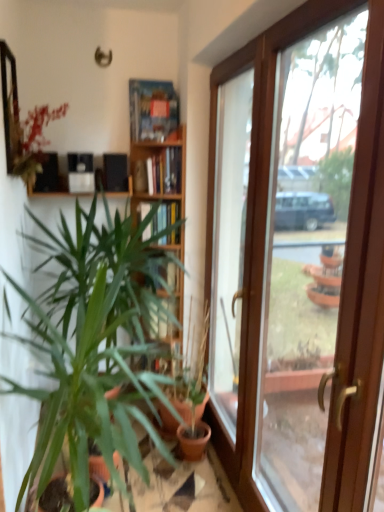
Question: Is green matte plant at left, which ranks as the 2th houseplant in right-to-left order, oriented towards clear glass door at center?

Choices:
 (A) no
 (B) yes

Answer: (A)

Question: Is green matte plant at left, positioned as the 1th houseplant in left-to-right order, oriented away from clear glass door at center?

Choices:
 (A) yes
 (B) no

Answer: (B)

Question: Is the depth of green matte plant at left, positioned as the 1th houseplant in left-to-right order, greater than that of clear glass door at center?

Choices:
 (A) yes
 (B) no

Answer: (A)

Question: Can you confirm if green matte plant at left, which ranks as the 2th houseplant in right-to-left order, is bigger than clear glass door at center?

Choices:
 (A) no
 (B) yes

Answer: (B)

Question: Is green matte plant at left, which ranks as the 2th houseplant in right-to-left order, positioned beyond the bounds of clear glass door at center?

Choices:
 (A) no
 (B) yes

Answer: (B)

Question: Looking at their shapes, would you say wooden bookshelf at center is wider or thinner than clear glass door at center?

Choices:
 (A) thin
 (B) wide

Answer: (B)

Question: Considering the positions of wooden bookshelf at center and clear glass door at center in the image, is wooden bookshelf at center bigger or smaller than clear glass door at center?

Choices:
 (A) small
 (B) big

Answer: (A)

Question: Would you say wooden bookshelf at center is to the left or to the right of clear glass door at center in the picture?

Choices:
 (A) left
 (B) right

Answer: (A)

Question: From a real-world perspective, is wooden bookshelf at center physically located above or below clear glass door at center?

Choices:
 (A) below
 (B) above

Answer: (A)

Question: From the image's perspective, is matte black shelf at upper left positioned above or below green matte plant at center, the 2th houseplant from the left?

Choices:
 (A) above
 (B) below

Answer: (A)

Question: Visually, is matte black shelf at upper left positioned to the left or to the right of green matte plant at center, arranged as the 1th houseplant when viewed from the right?

Choices:
 (A) left
 (B) right

Answer: (A)

Question: Is matte black shelf at upper left in front of or behind green matte plant at center, arranged as the 1th houseplant when viewed from the right, in the image?

Choices:
 (A) behind
 (B) front

Answer: (A)

Question: Looking at their shapes, would you say matte black shelf at upper left is wider or thinner than green matte plant at center, the 2th houseplant from the left?

Choices:
 (A) thin
 (B) wide

Answer: (A)

Question: Considering the positions of green matte plant at left, which ranks as the 2th houseplant in right-to-left order, and green matte plant at center, arranged as the 1th houseplant when viewed from the right, in the image, is green matte plant at left, which ranks as the 2th houseplant in right-to-left order, wider or thinner than green matte plant at center, arranged as the 1th houseplant when viewed from the right,?

Choices:
 (A) wide
 (B) thin

Answer: (A)

Question: Is green matte plant at left, which ranks as the 2th houseplant in right-to-left order, taller or shorter than green matte plant at center, arranged as the 1th houseplant when viewed from the right?

Choices:
 (A) short
 (B) tall

Answer: (B)